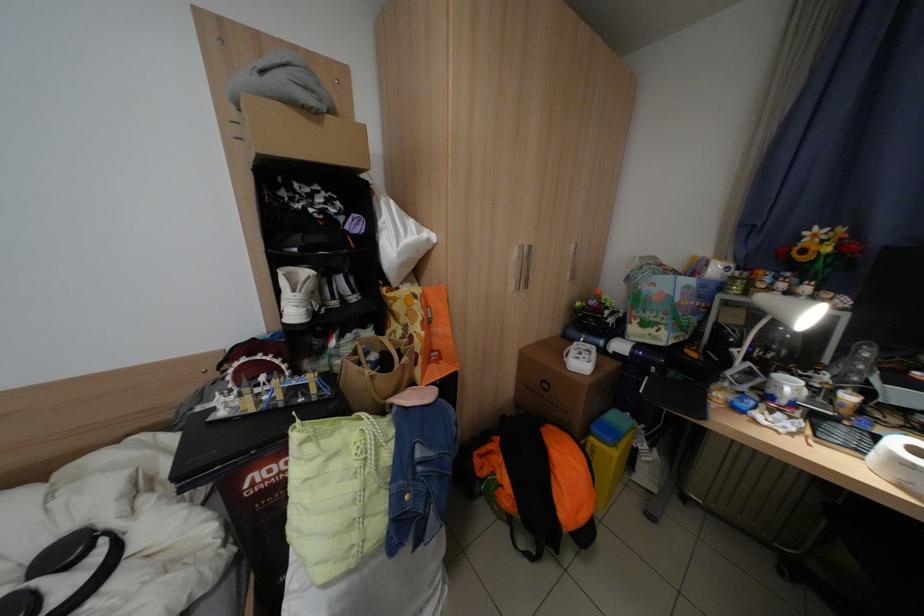
Where would you lift the brown cardboard box? Please return your answer as a coordinate pair (x, y).

(563, 386)